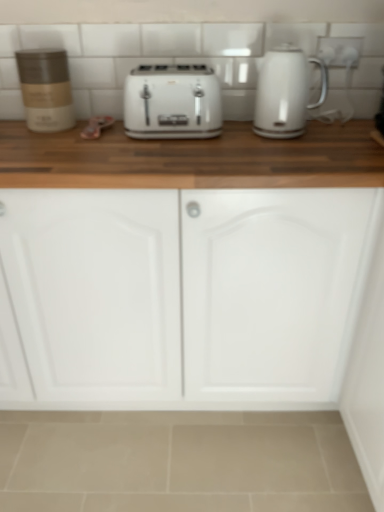
Question: Is white glossy toaster at center taller than white glossy electric kettle at upper right?

Choices:
 (A) no
 (B) yes

Answer: (A)

Question: Can you confirm if white glossy toaster at center is smaller than white glossy electric kettle at upper right?

Choices:
 (A) yes
 (B) no

Answer: (B)

Question: Is white glossy toaster at center next to white glossy electric kettle at upper right?

Choices:
 (A) yes
 (B) no

Answer: (B)

Question: Are white glossy toaster at center and white glossy electric kettle at upper right located far from each other?

Choices:
 (A) yes
 (B) no

Answer: (B)

Question: Is white glossy toaster at center outside white glossy electric kettle at upper right?

Choices:
 (A) yes
 (B) no

Answer: (A)

Question: Can you confirm if white glossy toaster at center is positioned to the right of white glossy electric kettle at upper right?

Choices:
 (A) yes
 (B) no

Answer: (B)

Question: Considering the relative sizes of white glossy toaster at center and matte brown container at left in the image provided, is white glossy toaster at center thinner than matte brown container at left?

Choices:
 (A) no
 (B) yes

Answer: (A)

Question: Is white glossy toaster at center positioned before matte brown container at left?

Choices:
 (A) no
 (B) yes

Answer: (B)

Question: Considering the relative positions of white glossy toaster at center and matte brown container at left in the image provided, is white glossy toaster at center to the left of matte brown container at left from the viewer's perspective?

Choices:
 (A) no
 (B) yes

Answer: (A)

Question: Considering the relative sizes of white glossy toaster at center and matte brown container at left in the image provided, is white glossy toaster at center smaller than matte brown container at left?

Choices:
 (A) yes
 (B) no

Answer: (B)

Question: Could you tell me if white glossy toaster at center is facing matte brown container at left?

Choices:
 (A) no
 (B) yes

Answer: (A)

Question: From the image's perspective, would you say white glossy toaster at center is shown under matte brown container at left?

Choices:
 (A) yes
 (B) no

Answer: (A)

Question: Does white glossy toaster at center have a lesser height compared to white matte cabinet doors at center?

Choices:
 (A) yes
 (B) no

Answer: (A)